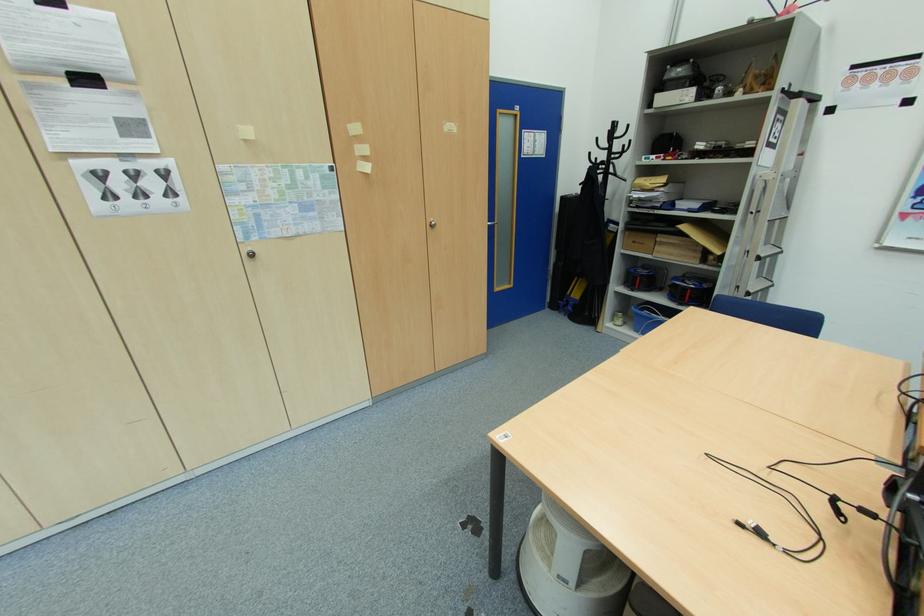
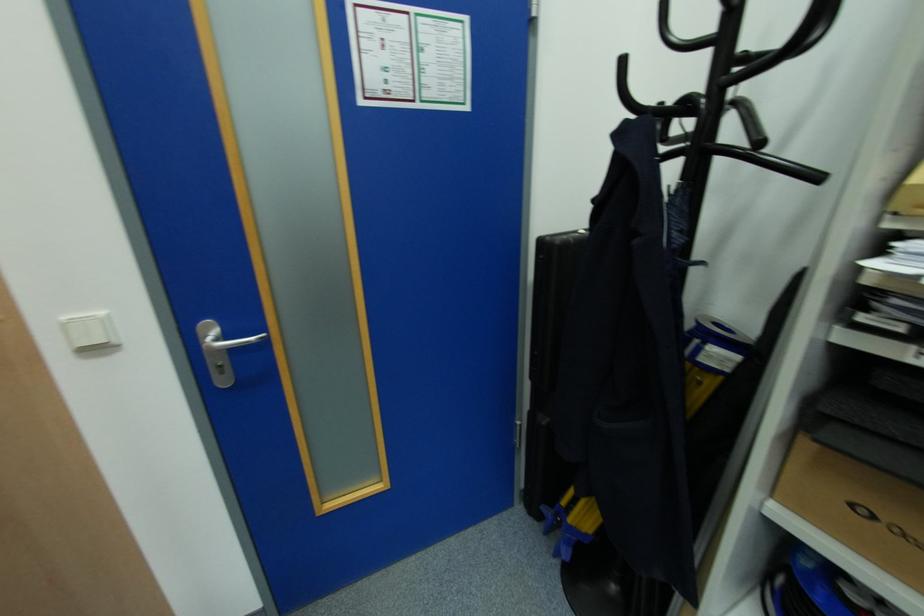
Where in the second image is the point corresponding to (x=614, y=154) from the first image?

(726, 61)